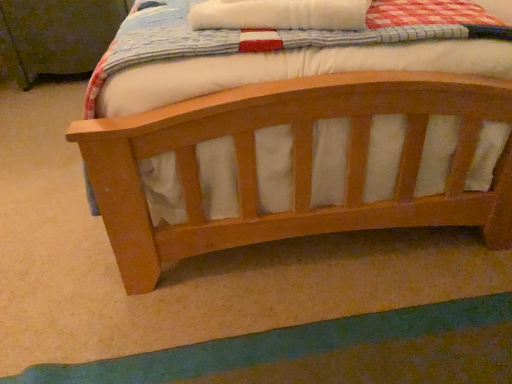
At what (x,y) coordinates should I click in order to perform the action: click on vacant space in green fabric at lower center (from a real-world perspective). Please return your answer as a coordinate pair (x, y). The height and width of the screenshot is (384, 512). Looking at the image, I should click on (346, 356).